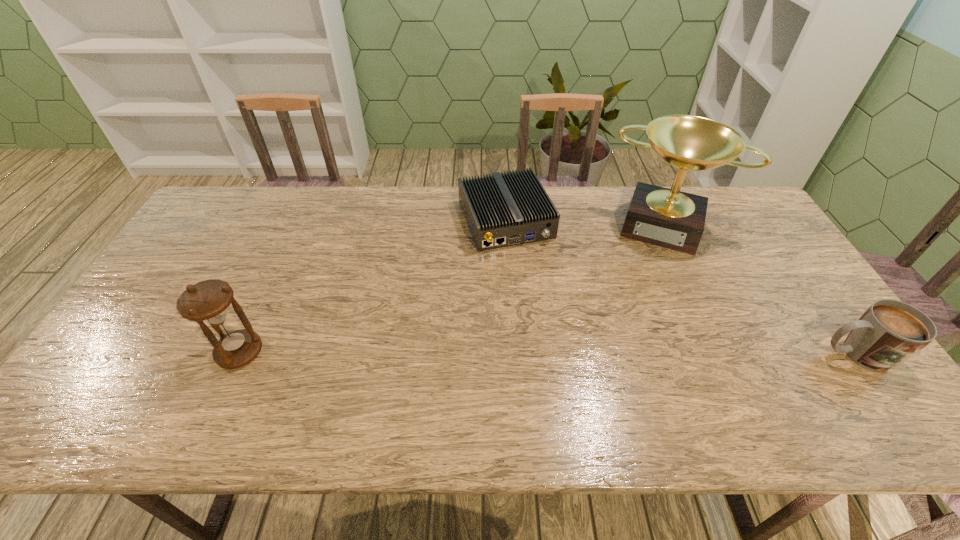
Find the location of a particular element. This screenshot has height=540, width=960. vacant spot on the desktop that is between the third shortest object and the rightmost object and is positioned on the back panel of the router is located at coordinates (567, 353).

Locate an element on the screen. The image size is (960, 540). vacant space on the desktop that is between the leftmost object and the mug and is positioned on the front-facing side of the award is located at coordinates (636, 353).